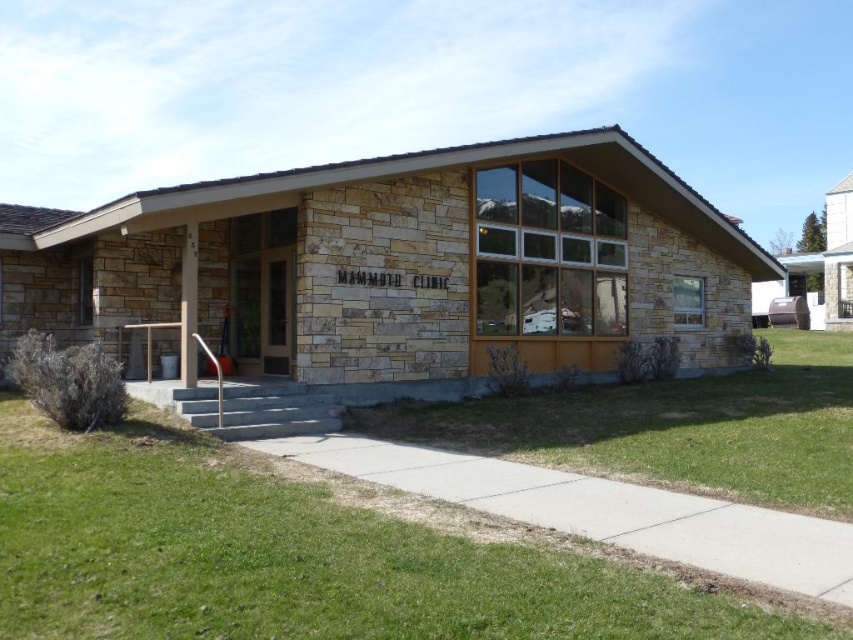
Does green grass at lower left lie in front of green grass at lower center?

Yes.

The height and width of the screenshot is (640, 853). Describe the element at coordinates (306, 556) in the screenshot. I see `green grass at lower left` at that location.

Does point (25, 593) come behind point (689, 388)?

That is False.

Locate an element on the screen. The height and width of the screenshot is (640, 853). green grass at lower left is located at coordinates (306, 556).